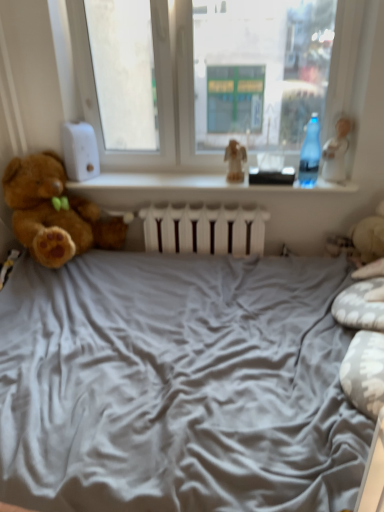
Locate an element on the screen. This screenshot has height=512, width=384. transparent plastic bottle at right is located at coordinates (310, 154).

Measure the distance between matte brown figurine at center, the 2th toy in the right-to-left sequence, and camera.

2.37 meters.

Image resolution: width=384 pixels, height=512 pixels. What do you see at coordinates (336, 152) in the screenshot?
I see `white glossy figurine at upper right, the second toy when ordered from left to right` at bounding box center [336, 152].

Find the location of a particular element. This screenshot has height=512, width=384. transparent plastic bottle at right is located at coordinates (310, 154).

Which is more to the right, transparent plastic bottle at upper center or brown plush teddy bear at left?

transparent plastic bottle at upper center.

Is transparent plastic bottle at upper center turned away from brown plush teddy bear at left?

transparent plastic bottle at upper center does not have its back to brown plush teddy bear at left.

Is the surface of transparent plastic bottle at upper center in direct contact with brown plush teddy bear at left?

transparent plastic bottle at upper center and brown plush teddy bear at left are not in contact.

Which object is wider, transparent plastic bottle at upper center or brown plush teddy bear at left?

Wider between the two is brown plush teddy bear at left.

Who is taller, matte brown figurine at center, the 1th toy from the left, or transparent plastic bottle at upper center?

matte brown figurine at center, the 1th toy from the left, is taller.

Would you say transparent plastic bottle at upper center is part of matte brown figurine at center, the 1th toy from the left,'s contents?

No, transparent plastic bottle at upper center is not surrounded by matte brown figurine at center, the 1th toy from the left.

From a real-world perspective, between matte brown figurine at center, the 2th toy in the right-to-left sequence, and transparent plastic bottle at upper center, who is vertically higher?

In real-world perspective, matte brown figurine at center, the 2th toy in the right-to-left sequence, is above.

Is matte brown figurine at center, the 2th toy in the right-to-left sequence, next to transparent plastic bottle at upper center?

matte brown figurine at center, the 2th toy in the right-to-left sequence, and transparent plastic bottle at upper center are not in contact.

Between transparent plastic bottle at upper center and transparent plastic bottle at right, which one has smaller size?

transparent plastic bottle at right is smaller.

From a real-world perspective, is transparent plastic bottle at upper center physically below transparent plastic bottle at right?

Indeed, from a real-world perspective, transparent plastic bottle at upper center is positioned beneath transparent plastic bottle at right.

From the image's perspective, is transparent plastic bottle at upper center on top of transparent plastic bottle at right?

No, from the image's perspective, transparent plastic bottle at upper center is not above transparent plastic bottle at right.

How different are the orientations of transparent plastic bottle at upper center and transparent plastic bottle at right in degrees?

1.62 degrees.

Which of these two, transparent glass window at center or white glossy figurine at upper right, the second toy when ordered from left to right, stands taller?

transparent glass window at center.

Does transparent glass window at center come in front of white glossy figurine at upper right, which is the 1th toy in right-to-left order?

Yes, it is in front of white glossy figurine at upper right, which is the 1th toy in right-to-left order.

Image resolution: width=384 pixels, height=512 pixels. I want to click on the 1st toy located beneath the transparent glass window at center (from a real-world perspective), so click(336, 152).

Is transparent plastic bottle at upper center not close to transparent glass window at center?

No, transparent plastic bottle at upper center is not far from transparent glass window at center.

Does transparent plastic bottle at upper center come behind transparent glass window at center?

Yes, it is.

Consider the image. Which is less distant, (77, 184) or (296, 119)?

The point (296, 119) is closer to the camera.

Which is more to the left, transparent plastic bottle at upper center or transparent glass window at center?

transparent glass window at center.

Image resolution: width=384 pixels, height=512 pixels. Identify the location of toy on the right of matte brown figurine at center, the 1th toy from the left. (336, 152).

Are white glossy figurine at upper right, which is the 1th toy in right-to-left order, and matte brown figurine at center, the 1th toy from the left, far apart?

That's not correct — white glossy figurine at upper right, which is the 1th toy in right-to-left order, is a little close to matte brown figurine at center, the 1th toy from the left.

Could you measure the distance between white glossy figurine at upper right, which is the 1th toy in right-to-left order, and matte brown figurine at center, the 2th toy in the right-to-left sequence?

A distance of 18.90 inches exists between white glossy figurine at upper right, which is the 1th toy in right-to-left order, and matte brown figurine at center, the 2th toy in the right-to-left sequence.

Consider the image. How many degrees apart are the facing directions of white glossy figurine at upper right, which is the 1th toy in right-to-left order, and matte brown figurine at center, the 1th toy from the left?

28 degrees separate the facing orientations of white glossy figurine at upper right, which is the 1th toy in right-to-left order, and matte brown figurine at center, the 1th toy from the left.

From a real-world perspective, which object stands above the other?

In real-world perspective, transparent glass window at center is above.

From the image's perspective, relative to brown plush teddy bear at left, is transparent glass window at center above or below?

Based on their image positions, transparent glass window at center is located above brown plush teddy bear at left.

Based on the photo, does transparent glass window at center have a lesser width compared to brown plush teddy bear at left?

Correct, the width of transparent glass window at center is less than that of brown plush teddy bear at left.

There is a brown plush teddy bear at left. Identify the location of window above it (from a real-world perspective). This screenshot has height=512, width=384. (218, 79).

What are the coordinates of `window sill that is above the brown plush teddy bear at left (from a real-world perspective)` in the screenshot? It's located at (196, 184).

I want to click on window sill below the matte brown figurine at center, the 1th toy from the left (from a real-world perspective), so click(196, 184).

Estimate the real-world distances between objects in this image. Which object is closer to white glossy figurine at upper right, the second toy when ordered from left to right, brown plush teddy bear at left or transparent plastic bottle at upper center?

transparent plastic bottle at upper center is positioned closer to the anchor white glossy figurine at upper right, the second toy when ordered from left to right.

Estimate the real-world distances between objects in this image. Which object is closer to transparent plastic bottle at right, matte brown figurine at center, the 2th toy in the right-to-left sequence, or transparent plastic bottle at upper center?

matte brown figurine at center, the 2th toy in the right-to-left sequence, lies closer to transparent plastic bottle at right than the other object.

From the image, which object appears to be farther from transparent plastic bottle at right, matte brown figurine at center, the 2th toy in the right-to-left sequence, or white glossy figurine at upper right, the second toy when ordered from left to right?

Among the two, matte brown figurine at center, the 2th toy in the right-to-left sequence, is located further to transparent plastic bottle at right.

Based on their spatial positions, is transparent glass window at center or matte brown figurine at center, the 2th toy in the right-to-left sequence, closer to brown plush teddy bear at left?

Among the two, transparent glass window at center is located nearer to brown plush teddy bear at left.

When comparing their distances from white glossy figurine at upper right, which is the 1th toy in right-to-left order, does transparent plastic bottle at right or transparent plastic bottle at upper center seem further?

Based on the image, transparent plastic bottle at upper center appears to be further to white glossy figurine at upper right, which is the 1th toy in right-to-left order.

When comparing their distances from transparent glass window at center, does brown plush teddy bear at left or white glossy figurine at upper right, which is the 1th toy in right-to-left order, seem closer?

white glossy figurine at upper right, which is the 1th toy in right-to-left order, is closer to transparent glass window at center.

Considering their positions, is transparent plastic bottle at right positioned further to matte brown figurine at center, the 1th toy from the left, than brown plush teddy bear at left?

brown plush teddy bear at left lies further to matte brown figurine at center, the 1th toy from the left, than the other object.

From the image, which object appears to be farther from transparent plastic bottle at upper center, white glossy figurine at upper right, which is the 1th toy in right-to-left order, or transparent plastic bottle at right?

white glossy figurine at upper right, which is the 1th toy in right-to-left order, is positioned further to the anchor transparent plastic bottle at upper center.

Locate an element on the screen. The height and width of the screenshot is (512, 384). toy between brown plush teddy bear at left and white glossy figurine at upper right, the second toy when ordered from left to right is located at coordinates (235, 161).

You are a GUI agent. You are given a task and a screenshot of the screen. Output one action in this format:
    pyautogui.click(x=<x>, y=<y>)
    Task: Click on the bottle between transparent plastic bottle at upper center and white glossy figurine at upper right, which is the 1th toy in right-to-left order, in the horizontal direction
    
    Given the screenshot: What is the action you would take?
    pyautogui.click(x=310, y=154)

Where is `bottle located between matte brown figurine at center, the 2th toy in the right-to-left sequence, and white glossy figurine at upper right, which is the 1th toy in right-to-left order, in the left-right direction`? The image size is (384, 512). bottle located between matte brown figurine at center, the 2th toy in the right-to-left sequence, and white glossy figurine at upper right, which is the 1th toy in right-to-left order, in the left-right direction is located at coordinates (310, 154).

Where is `bottle situated between brown plush teddy bear at left and white glossy figurine at upper right, which is the 1th toy in right-to-left order, from left to right`? bottle situated between brown plush teddy bear at left and white glossy figurine at upper right, which is the 1th toy in right-to-left order, from left to right is located at coordinates (310, 154).